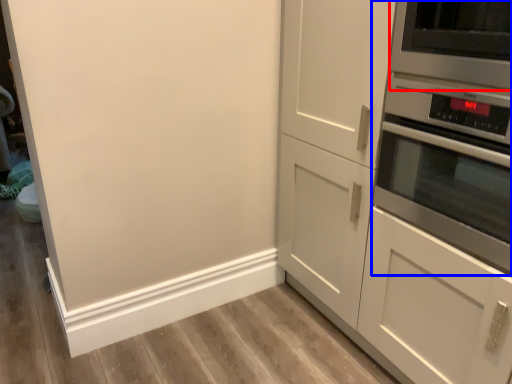
Question: Which of the following is the farthest to the observer, appliance (highlighted by a red box) or home appliance (highlighted by a blue box)?

Choices:
 (A) appliance
 (B) home appliance

Answer: (A)